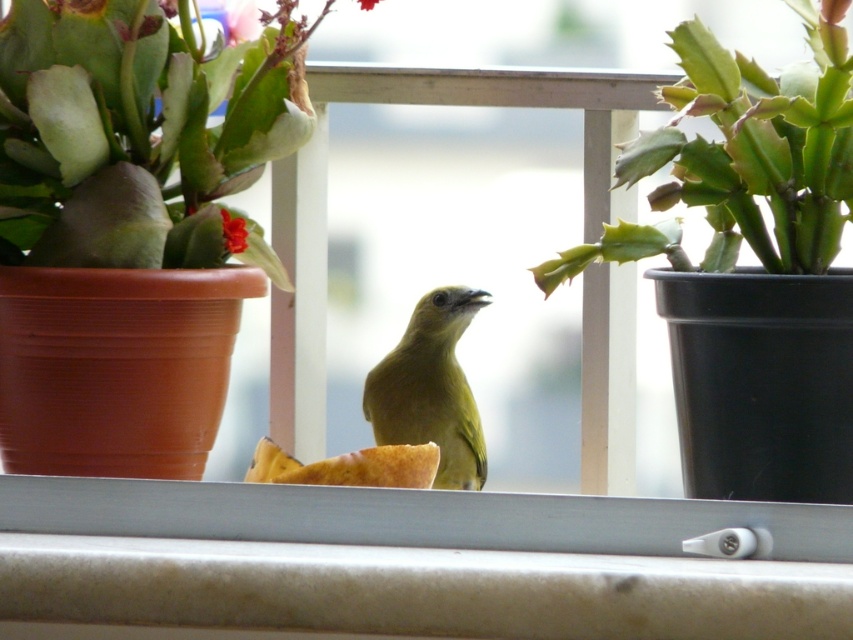
You are a gardener who wants to plant two flowers in a row. You have a smooth red flower at center and a green matte flower at center. According to the image, which flower should you place first if you want to follow the arrangement from top to bottom?

The green matte flower at center should be placed first at the top since it is positioned above the smooth red flower at center in the image.

You are a gardener who wants to water the green matte succulent at left and the pink matte flower at upper left. Which one should you water first if you want to start from the lowest point?

The green matte succulent at left should be watered first because it is positioned under the pink matte flower at upper left, making it lower in height.